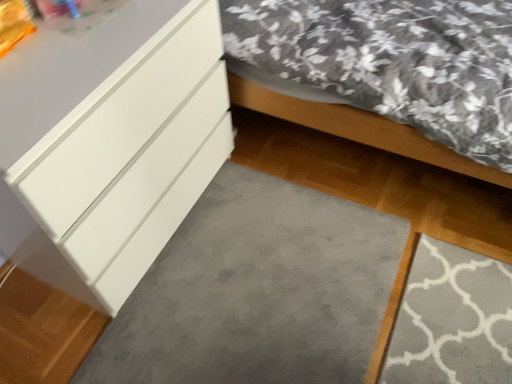
Find the location of a particular element. The width and height of the screenshot is (512, 384). vacant area on top of gray soft carpet at lower center (from a real-world perspective) is located at coordinates (233, 301).